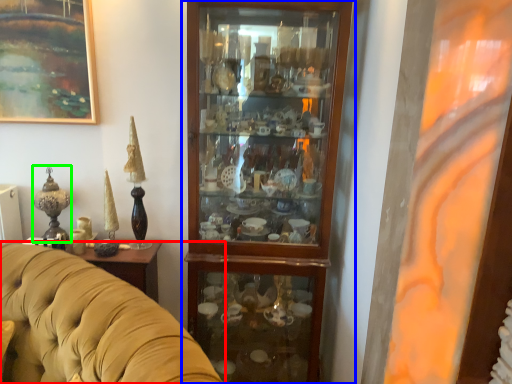
Question: Based on their relative distances, which object is farther from studio couch (highlighted by a red box)? Choose from cupboard (highlighted by a blue box) and candle holder (highlighted by a green box).

Choices:
 (A) cupboard
 (B) candle holder

Answer: (A)